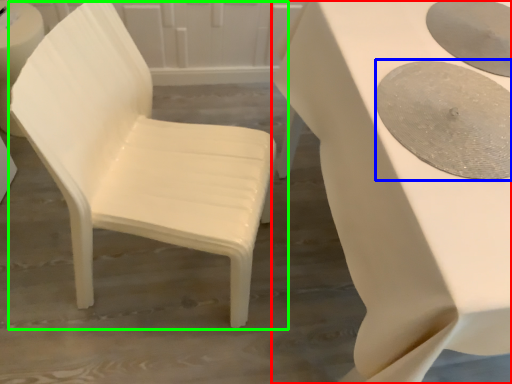
Question: Based on their relative distances, which object is nearer to table (highlighted by a red box)? Choose from oval (highlighted by a blue box) and chair (highlighted by a green box).

Choices:
 (A) oval
 (B) chair

Answer: (A)